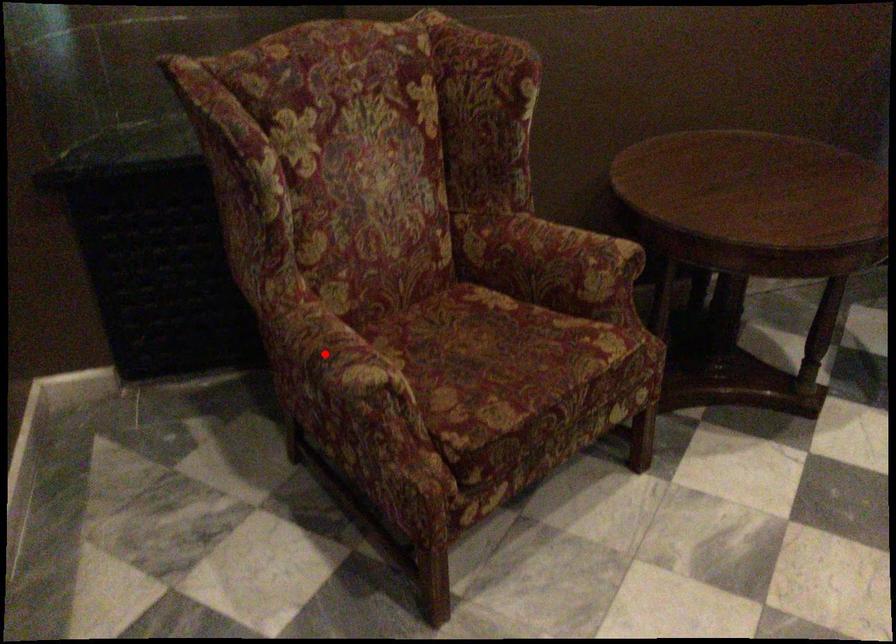
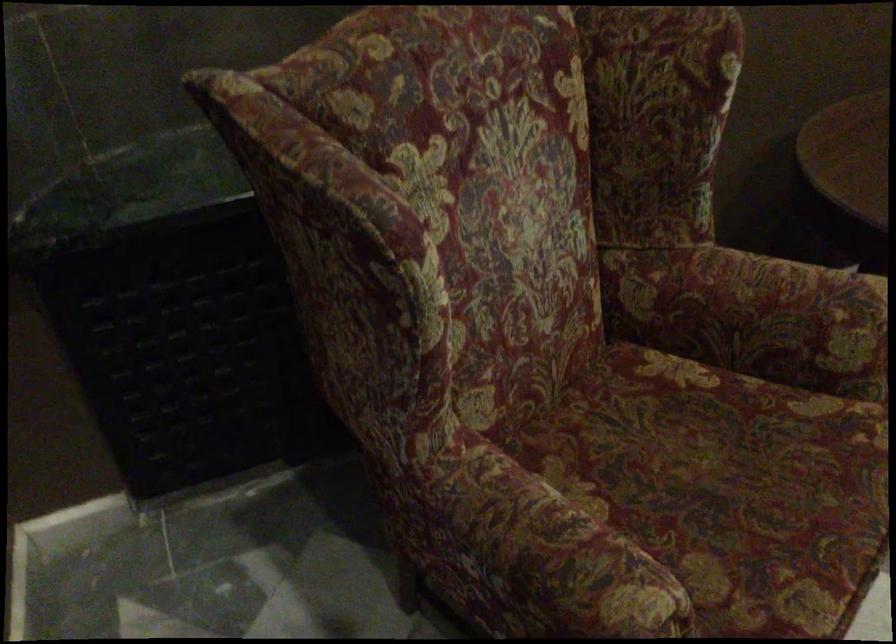
Locate, in the second image, the point that corresponds to the highlighted location in the first image.

(543, 559)